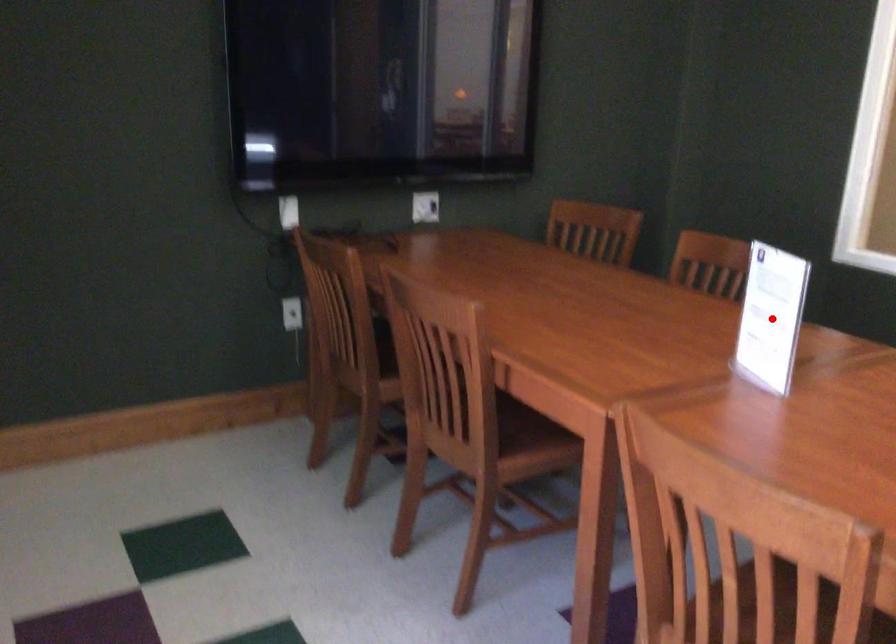
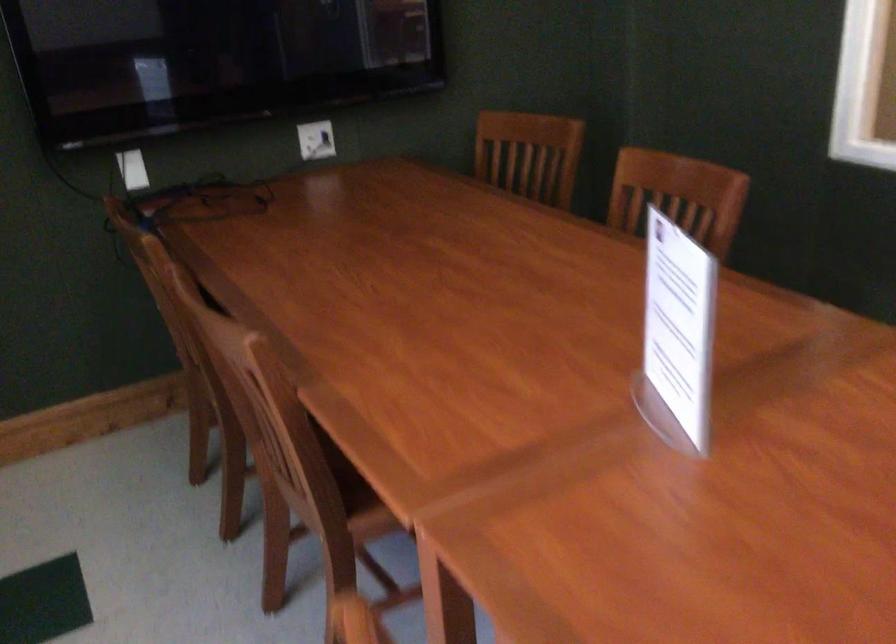
Question: I am providing you with two images of the same scene from different viewpoints. A red point is shown in image1. For the corresponding object point in image2, is it positioned nearer or farther from the camera?

Choices:
 (A) Nearer
 (B) Farther

Answer: (A)